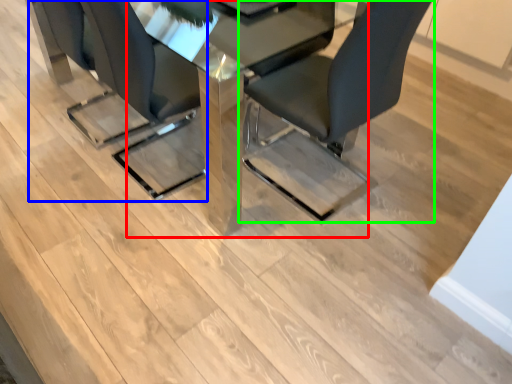
Question: Which object is positioned closest to table (highlighted by a red box)? Select from chair (highlighted by a blue box) and chair (highlighted by a green box).

Choices:
 (A) chair
 (B) chair

Answer: (B)